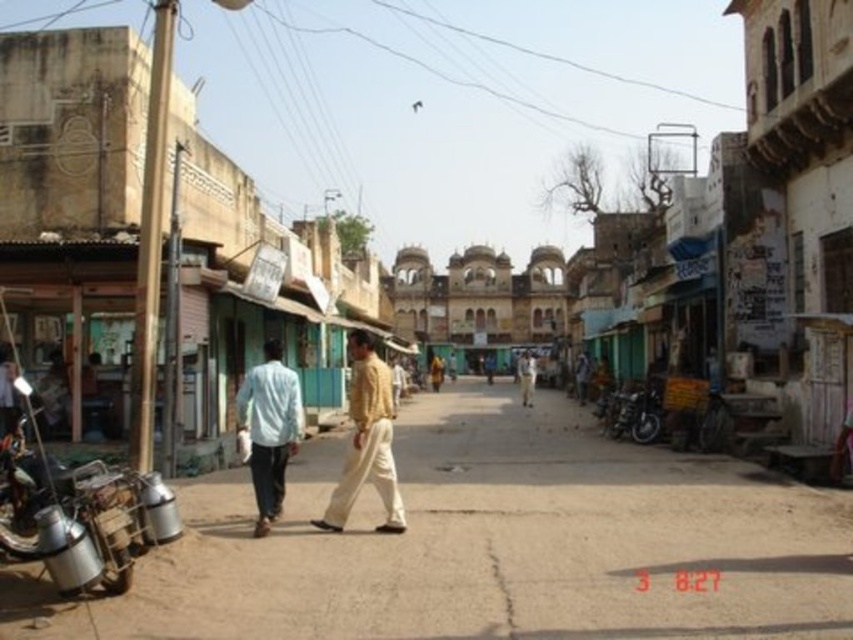
You are a delivery person who needs to park your metallic silver motorcycle at left near the yellow matte shirt at center. Considering the space they occupy, will the motorcycle fit without overlapping the shirt?

The metallic silver motorcycle at left occupies less space than the yellow matte shirt at center. Therefore, the motorcycle can be parked near the yellow matte shirt at center without overlapping it, as it requires less space.

Looking at this image, you are standing at the center of the street in the village scene. There is a specific point marked at coordinates point [416,608]. If you want to walk towards this point, how far will you have to walk in meters?

The distance of point [416,608] from viewer is 135.82 meters, so you will have to walk 135.82 meters to reach it.